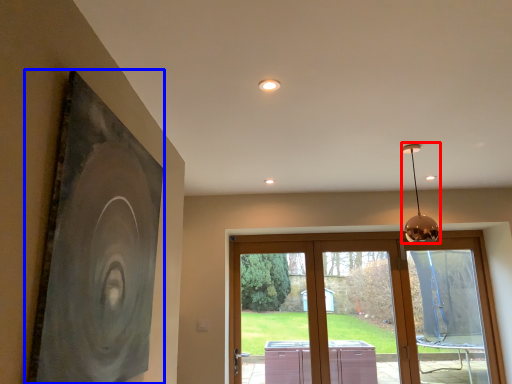
Question: Which object appears farthest to the camera in this image, lamp (highlighted by a red box) or picture frame (highlighted by a blue box)?

Choices:
 (A) lamp
 (B) picture frame

Answer: (A)